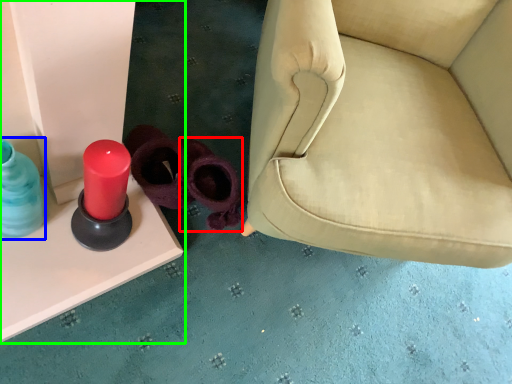
Question: Estimate the real-world distances between objects in this image. Which object is closer to footwear (highlighted by a red box), bottle (highlighted by a blue box) or furniture (highlighted by a green box)?

Choices:
 (A) bottle
 (B) furniture

Answer: (B)